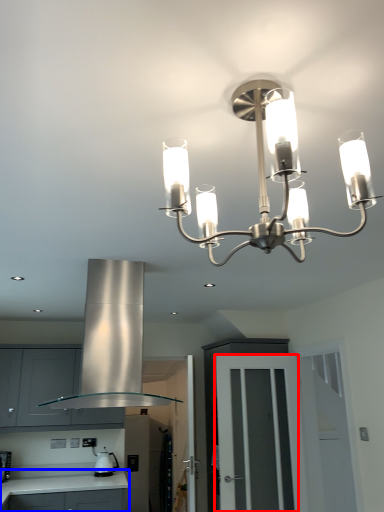
Question: Among these objects, which one is nearest to the camera, glass door (highlighted by a red box) or countertop (highlighted by a blue box)?

Choices:
 (A) glass door
 (B) countertop

Answer: (A)